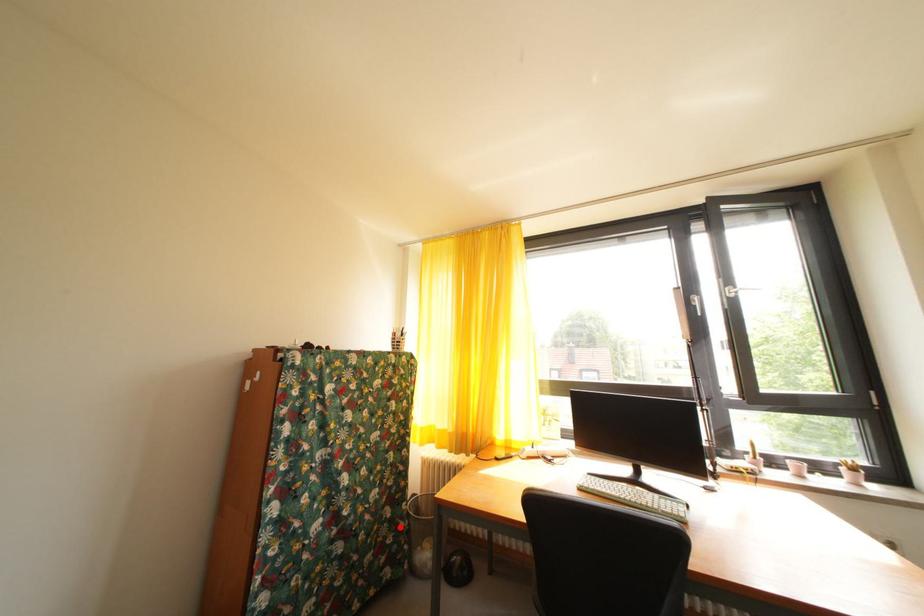
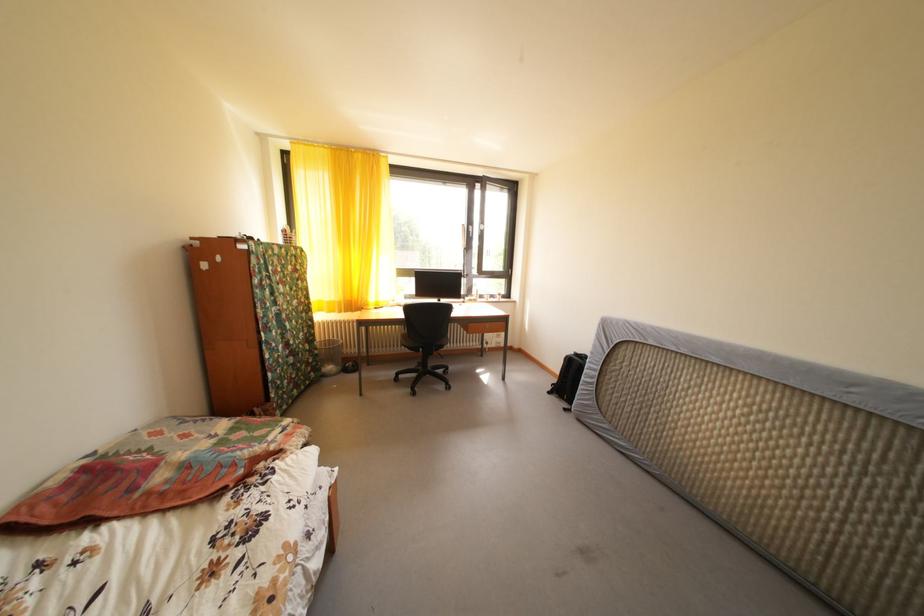
Question: I am providing you with two images of the same scene from different viewpoints. Given a red point in image1, look at the same physical point in image2. Is it:

Choices:
 (A) Closer to the viewpoint
 (B) Farther from the viewpoint

Answer: (A)